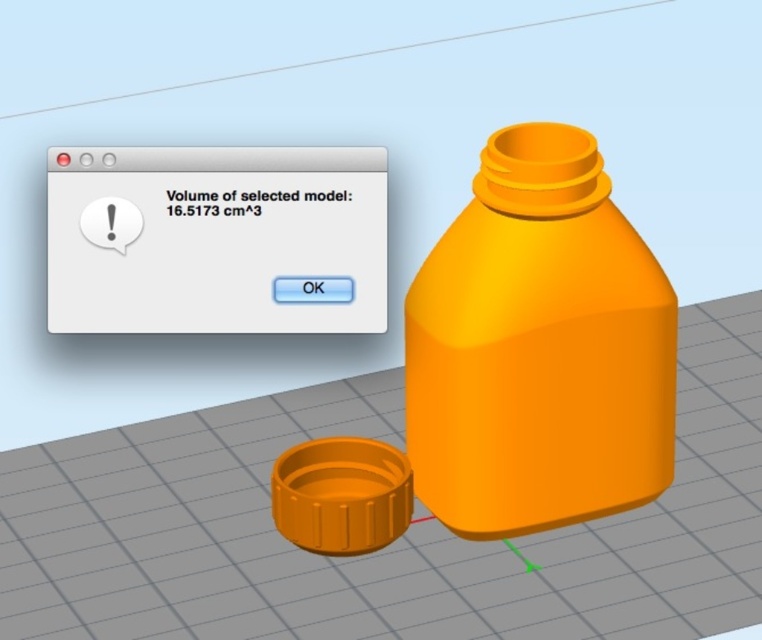
Does orange matte plastic bottle at center have a lesser height compared to matte orange plastic bottle at center?

No.

Can you confirm if orange matte plastic bottle at center is taller than matte orange plastic bottle at center?

Yes.

Describe the element at coordinates (538, 348) in the screenshot. This screenshot has height=640, width=762. I see `orange matte plastic bottle at center` at that location.

This screenshot has width=762, height=640. What are the coordinates of `orange matte plastic bottle at center` in the screenshot? It's located at coord(538,348).